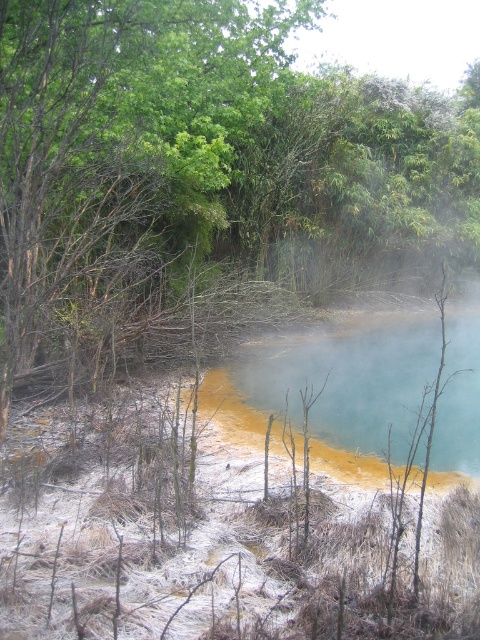
Question: Does green leafy tree at upper center have a lesser width compared to blue-green water at center?

Choices:
 (A) yes
 (B) no

Answer: (B)

Question: Which of the following is the farthest from the observer?

Choices:
 (A) blue-green water at center
 (B) green leafy tree at upper center

Answer: (A)

Question: Where is green leafy tree at upper center located in relation to blue-green water at center in the image?

Choices:
 (A) left
 (B) right

Answer: (A)

Question: Can you confirm if green leafy tree at upper center is positioned to the right of blue-green water at center?

Choices:
 (A) no
 (B) yes

Answer: (A)

Question: Which point is farther to the camera?

Choices:
 (A) (245, 378)
 (B) (322, 156)

Answer: (B)

Question: Which point is farther to the camera?

Choices:
 (A) blue-green water at center
 (B) green leafy tree at upper center

Answer: (A)